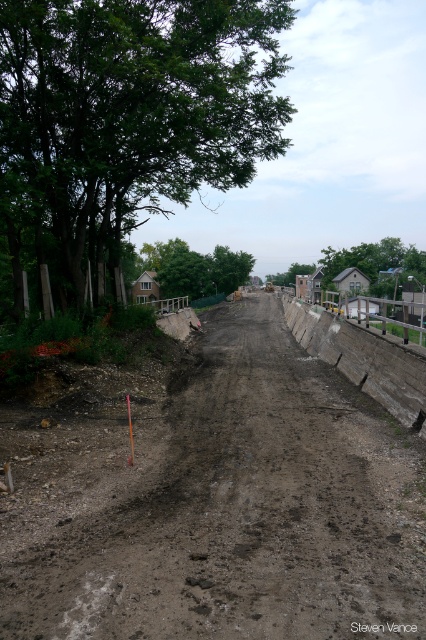
From the picture: Can you confirm if dull brown dirt track at center is smaller than green leafy tree at center?

Correct, dull brown dirt track at center occupies less space than green leafy tree at center.

Is dull brown dirt track at center wider than green leafy tree at center?

No.

Is point (299, 360) less distant than point (215, 282)?

Yes, it is in front of point (215, 282).

Identify the location of dull brown dirt track at center. This screenshot has width=426, height=640. (215, 500).

Describe the element at coordinates (215, 500) in the screenshot. I see `dull brown dirt track at center` at that location.

At what (x,y) coordinates should I click in order to perform the action: click on dull brown dirt track at center. Please return your answer as a coordinate pair (x, y). The image size is (426, 640). Looking at the image, I should click on pyautogui.click(x=215, y=500).

Is point (170, 252) in front of point (331, 252)?

Yes, it is.

Between green leafy tree at center and green leafy tree at upper center, which one appears on the left side from the viewer's perspective?

green leafy tree at center

What do you see at coordinates (195, 268) in the screenshot? I see `green leafy tree at center` at bounding box center [195, 268].

Locate an element on the screen. The width and height of the screenshot is (426, 640). green leafy tree at center is located at coordinates (195, 268).